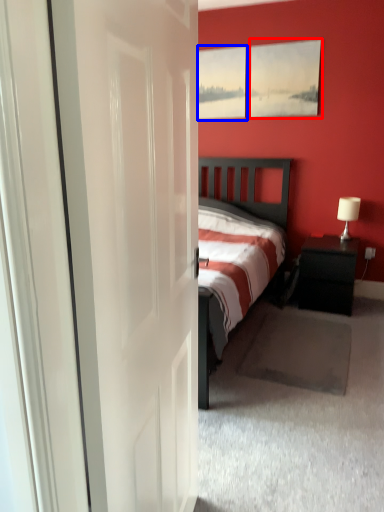
Question: Among these objects, which one is nearest to the camera, picture frame (highlighted by a red box) or window (highlighted by a blue box)?

Choices:
 (A) picture frame
 (B) window

Answer: (A)